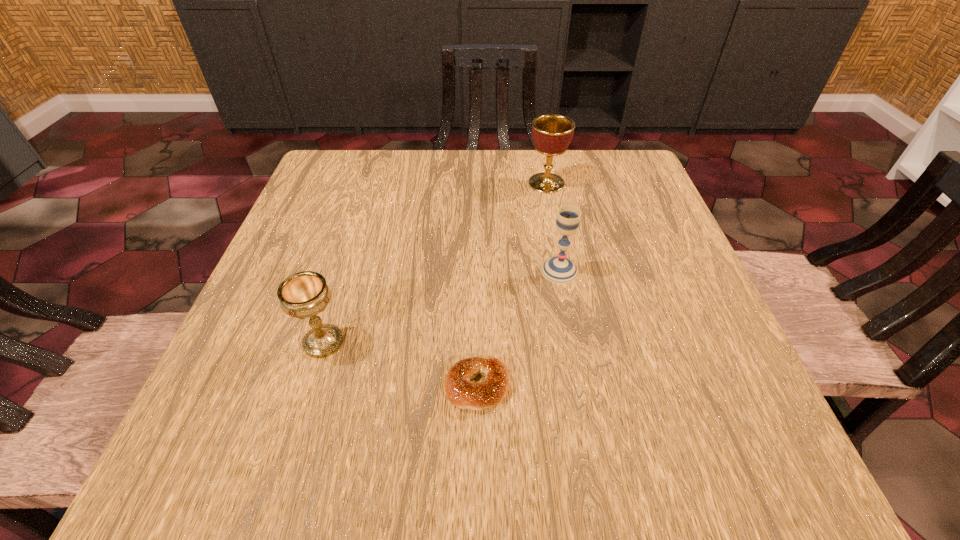
Select which object is the second closest to the farthest object. Please provide its 2D coordinates. Your answer should be formatted as a tuple, i.e. [(x, y)], where the tuple contains the x and y coordinates of a point satisfying the conditions above.

[(464, 394)]

Where is `object that is the closest to the second object from left to right`? Image resolution: width=960 pixels, height=540 pixels. object that is the closest to the second object from left to right is located at coordinates (305, 294).

Identify which chalice is located as the second nearest to the leftmost chalice. Please provide its 2D coordinates. Your answer should be formatted as a tuple, i.e. [(x, y)], where the tuple contains the x and y coordinates of a point satisfying the conditions above.

[(552, 133)]

Select which chalice is the closest to the third farthest object. Please provide its 2D coordinates. Your answer should be formatted as a tuple, i.e. [(x, y)], where the tuple contains the x and y coordinates of a point satisfying the conditions above.

[(560, 270)]

At what (x,y) coordinates should I click in order to perform the action: click on vacant region that satisfies the following two spatial constraints: 1. on the back side of the bagel; 2. on the right side of the third nearest object. Please return your answer as a coordinate pair (x, y). This screenshot has height=540, width=960. Looking at the image, I should click on (478, 271).

The height and width of the screenshot is (540, 960). What are the coordinates of `free location that satisfies the following two spatial constraints: 1. on the back side of the second nearest chalice; 2. on the left side of the farthest chalice` in the screenshot? It's located at (543, 183).

The height and width of the screenshot is (540, 960). What are the coordinates of `free spot that satisfies the following two spatial constraints: 1. on the back side of the farthest object; 2. on the left side of the nearest chalice` in the screenshot? It's located at (372, 183).